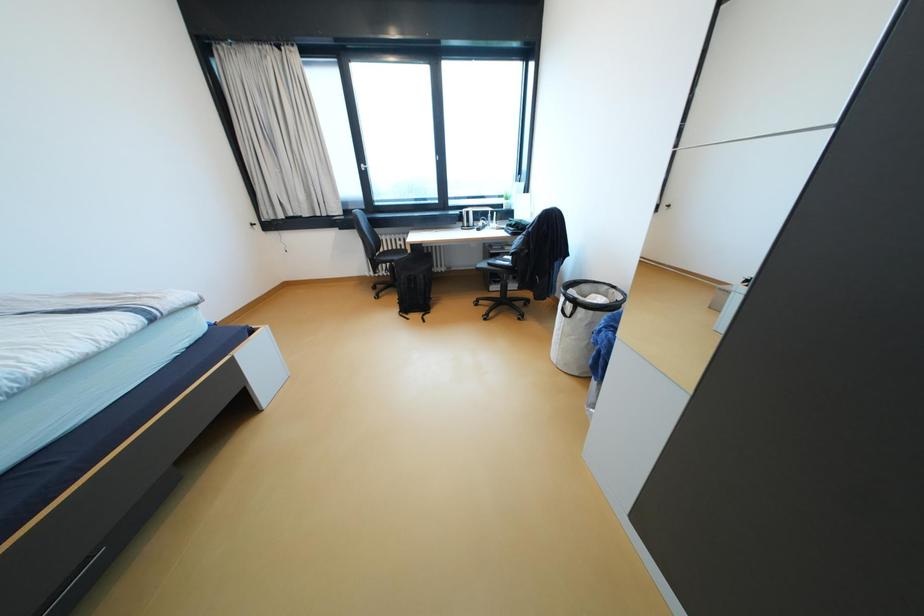
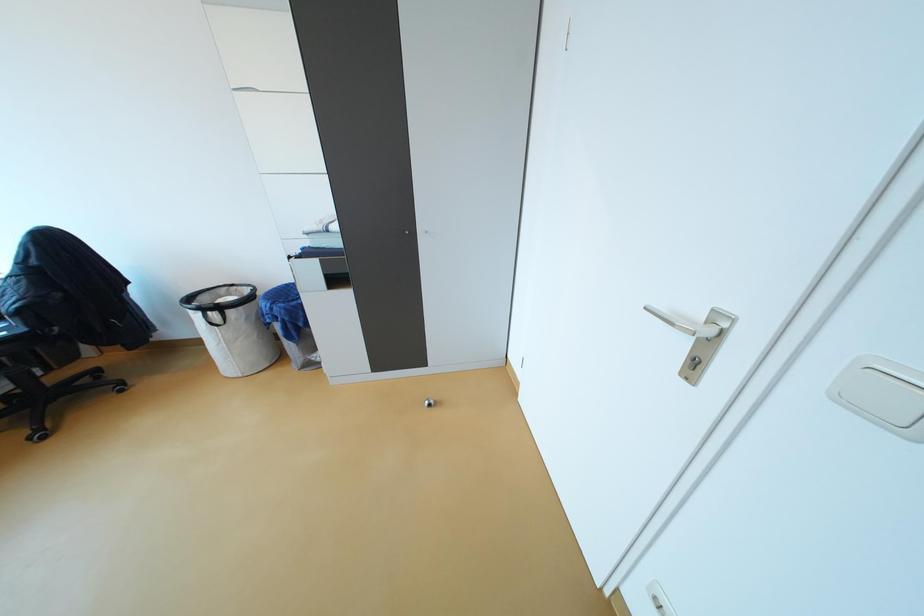
Based on the continuous images, in which direction is the camera rotating?

The rotation direction of the camera is right-down.